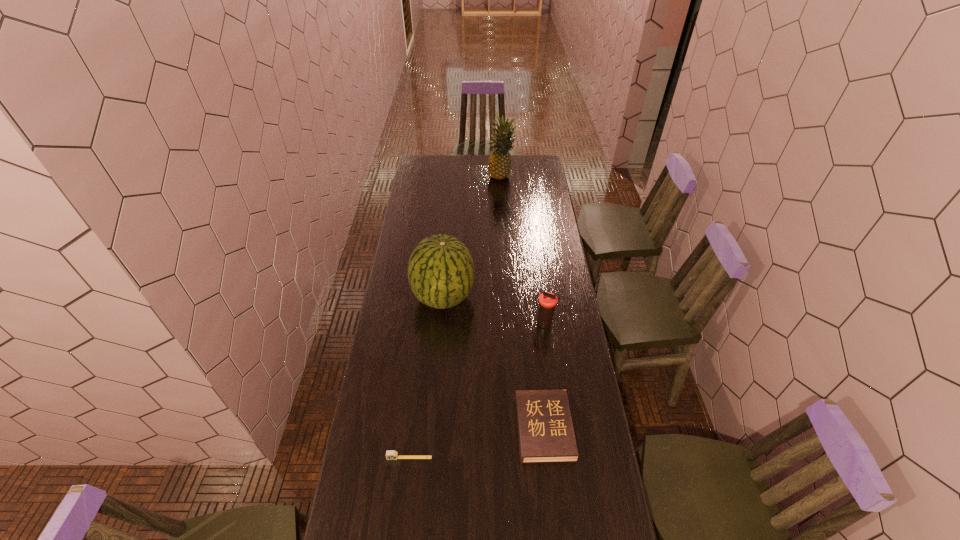
The height and width of the screenshot is (540, 960). In order to click on the farthest object in this screenshot , I will do `click(499, 165)`.

Find the location of `pineapple`. pineapple is located at coordinates (499, 165).

This screenshot has height=540, width=960. What are the coordinates of `watermelon` in the screenshot? It's located at (441, 274).

The width and height of the screenshot is (960, 540). In order to click on thermos bottle in this screenshot , I will do `click(547, 301)`.

Locate an element on the screen. This screenshot has width=960, height=540. hardback book is located at coordinates (545, 430).

Find the location of a particular element. The width and height of the screenshot is (960, 540). tape measure is located at coordinates (390, 454).

You are a GUI agent. You are given a task and a screenshot of the screen. Output one action in this format:
    pyautogui.click(x=<x>, y=<y>)
    Task: Click on the free space located 0.390m on the front of the tallest object
    
    Given the screenshot: What is the action you would take?
    pyautogui.click(x=505, y=225)

The width and height of the screenshot is (960, 540). Find the location of `free spot located 0.270m on the front of the fourth shortest object`. free spot located 0.270m on the front of the fourth shortest object is located at coordinates tap(438, 376).

At what (x,y) coordinates should I click in order to perform the action: click on vacant region located 0.080m on the left of the thermos bottle. Please return your answer as a coordinate pair (x, y). This screenshot has width=960, height=540. Looking at the image, I should click on (516, 325).

You are a GUI agent. You are given a task and a screenshot of the screen. Output one action in this format:
    pyautogui.click(x=<x>, y=<y>)
    Task: Click on the vacant space located on the left of the hardback book
    The width and height of the screenshot is (960, 540).
    Given the screenshot: What is the action you would take?
    pyautogui.click(x=444, y=428)